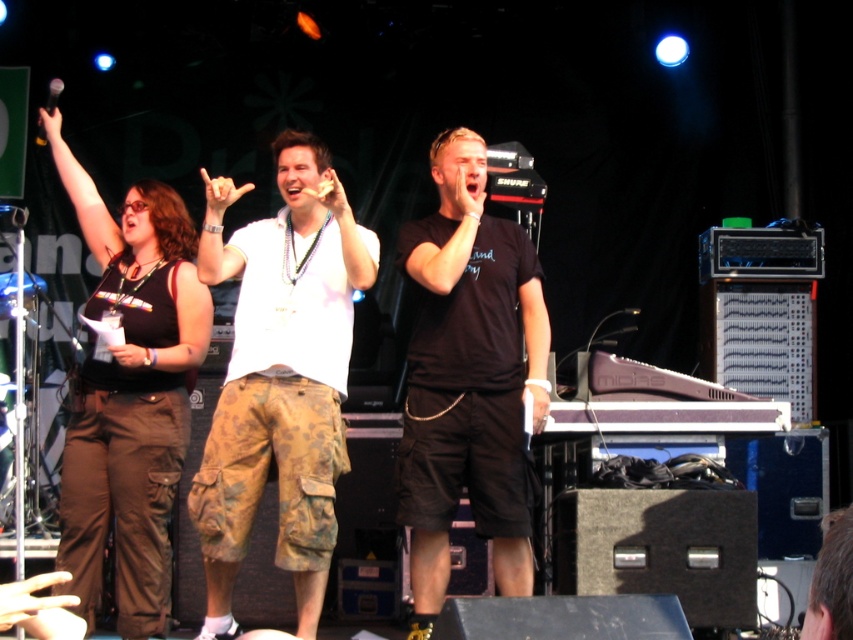
You are a photographer at the music festival and want to capture the camo shorts at center and matte black tank top at center in a single photo. Which object should you focus on first to ensure both are in frame?

The camo shorts at center is positioned under matte black tank top at center, so you should focus on the matte black tank top at center first to ensure both are in frame.

You are a photographer at the music festival and want to capture a closeup shot of both the camo shorts at center and the matte black tank top at center in the same frame. Given that your camera has a minimum focus distance of 30 centimeters, can you achieve this without moving the camera or the subjects?

The camo shorts at center is 37.60 centimeters away from matte black tank top at center. Since the distance between them is greater than the camera minimum focus distance of 30 centimeters, you can capture both in the same frame without needing to move the camera or subjects.